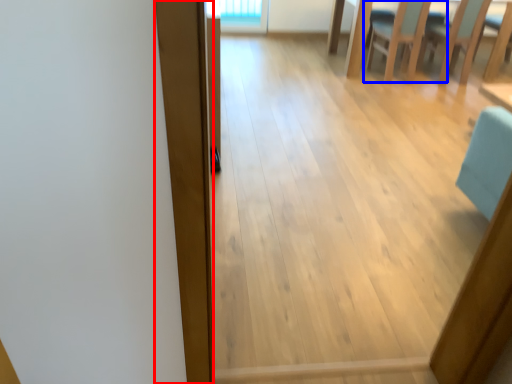
Question: Among these objects, which one is nearest to the camera, plank (highlighted by a red box) or chair (highlighted by a blue box)?

Choices:
 (A) plank
 (B) chair

Answer: (A)